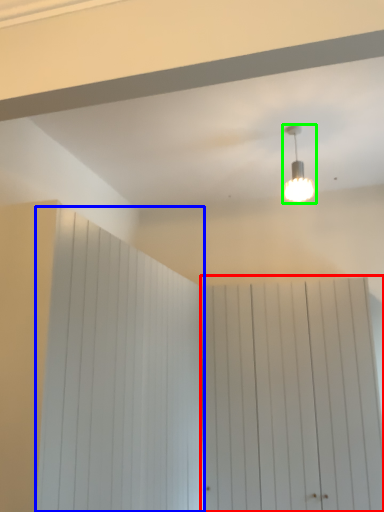
Question: Which object is positioned closest to barn door (highlighted by a red box)? Select from barn door (highlighted by a blue box) and lamp (highlighted by a green box).

Choices:
 (A) barn door
 (B) lamp

Answer: (A)